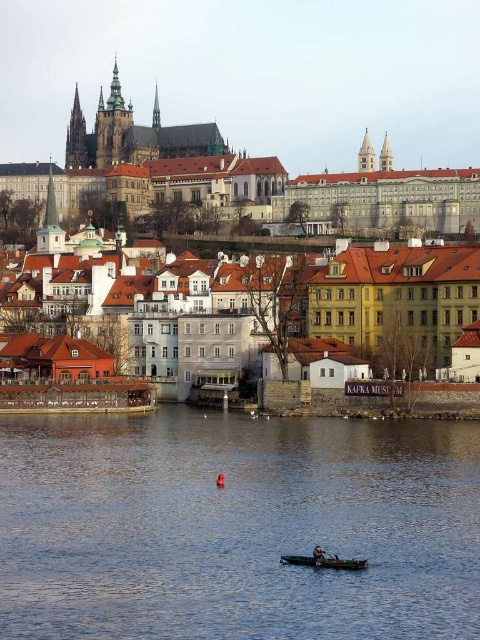
From the picture: Can you confirm if blue water at lower center is shorter than dark brown stone castle at upper center?

Indeed, blue water at lower center has a lesser height compared to dark brown stone castle at upper center.

Is point (73, 580) behind point (81, 157)?

No.

Find the location of a particular element. blue water at lower center is located at coordinates (237, 528).

Which of these two, dark brown stone castle at upper center or wooden canoe at lower center, stands taller?

dark brown stone castle at upper center

Between dark brown stone castle at upper center and wooden canoe at lower center, which one is positioned lower?

wooden canoe at lower center is below.

Who is more distant from viewer, (164, 125) or (312, 563)?

The point (164, 125) is behind.

You are a GUI agent. You are given a task and a screenshot of the screen. Output one action in this format:
    pyautogui.click(x=<x>, y=<y>)
    Task: Click on the dark brown stone castle at upper center
    This screenshot has height=640, width=480.
    Given the screenshot: What is the action you would take?
    pyautogui.click(x=132, y=134)

Who is taller, brown/brick townhouses at center or wooden canoe at lower center?

With more height is brown/brick townhouses at center.

Is brown/brick townhouses at center positioned at the back of wooden canoe at lower center?

Yes, it is.

At what (x,y) coordinates should I click in order to perform the action: click on brown/brick townhouses at center. Please return your answer as a coordinate pair (x, y). Image resolution: width=480 pixels, height=640 pixels. Looking at the image, I should click on (230, 179).

Where is `brown/brick townhouses at center`? brown/brick townhouses at center is located at coordinates (230, 179).